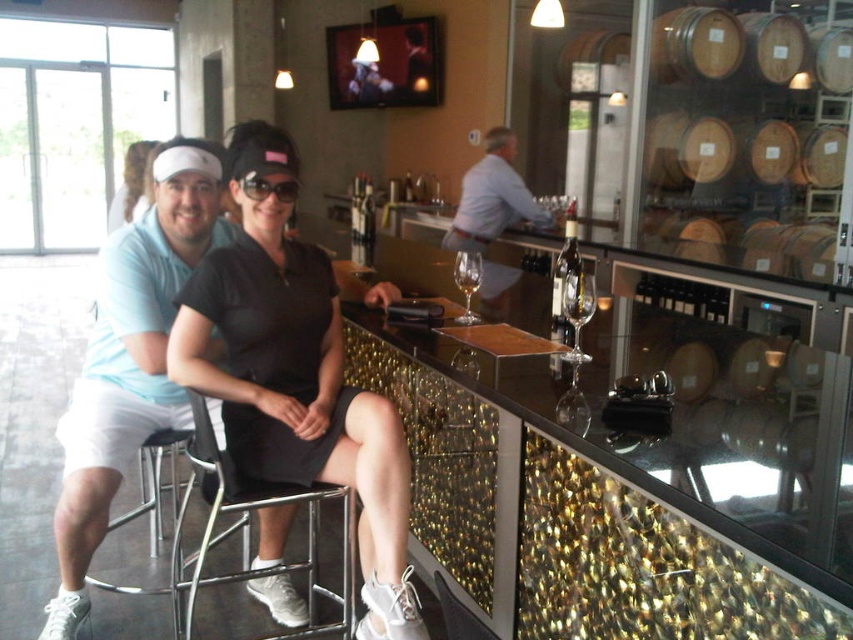
You are a bartender who needs to place a new wine glass on the bar. The new glass is exactly the same size as the clear glass wine at center. Will it fit in the space currently occupied by the clear glass wine at bar center?

The clear glass wine at center has a lesser width compared to the clear glass wine at bar center. Therefore, the new glass, being the same size as the smaller one, will fit in the space occupied by the larger glass.

You are a bartender and you need to pour wine into the clear glass wine at center and the clear glass wine at bar center. Which glass should you pour more wine into to ensure both glasses have the same final level?

You should pour more wine into the clear glass wine at center because it has a lesser height compared to the clear glass wine at bar center, so to reach the same level, the shorter glass needs more wine to fill up to that height.

In the scene shown: You are a photographer trying to capture a candid shot of the light blue shirt at center without including the black matte dress at center in the frame. Is this possible given their positions?

The black matte dress at center is in front of the light blue shirt at center, so it would block the view. Therefore, capturing the light blue shirt at center without the black matte dress at center in the frame is not possible.